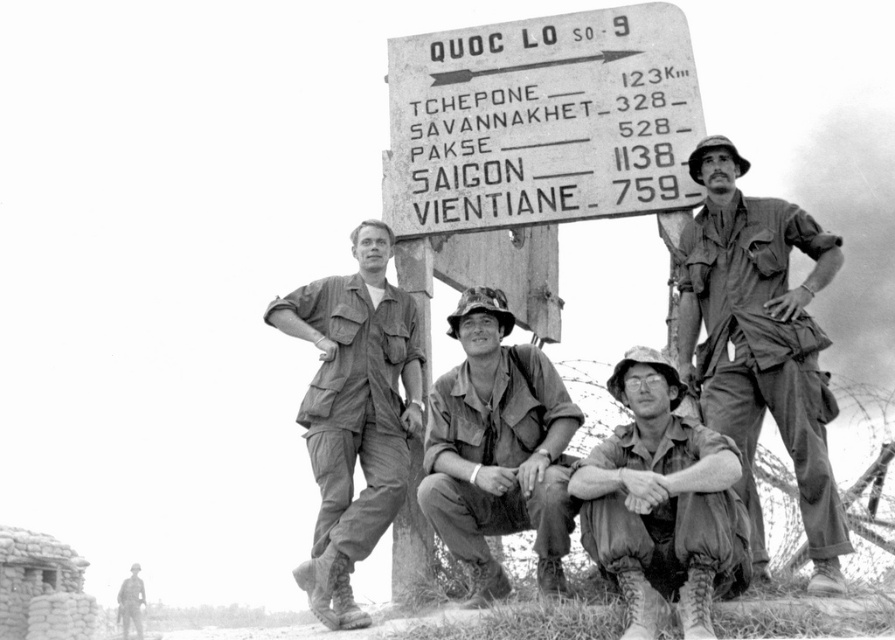
You are a photographer who needs to capture a clear image of the road sign in the background while ensuring both the matte khaki uniform at center and the camouflage fabric uniform at center are visible. Which uniform should you position closer to the camera to ensure it appears larger in the photo?

The matte khaki uniform at center is taller than the camouflage fabric uniform at center, so positioning the matte khaki uniform at center closer to the camera will make it appear larger in the photo.

Based on the scene described, which object is shorter between the stone signpost at center and the matte khaki uniform at right?

The stone signpost at center is shorter than the matte khaki uniform at right.

You are a photographer who took a black and white photo of a road sign with a group of people wearing uniforms. The road sign has distances to several cities listed. In your photo, where exactly did you place the matte khaki uniform at center in terms of coordinates?

The matte khaki uniform at center is located at coordinates point (354,413).